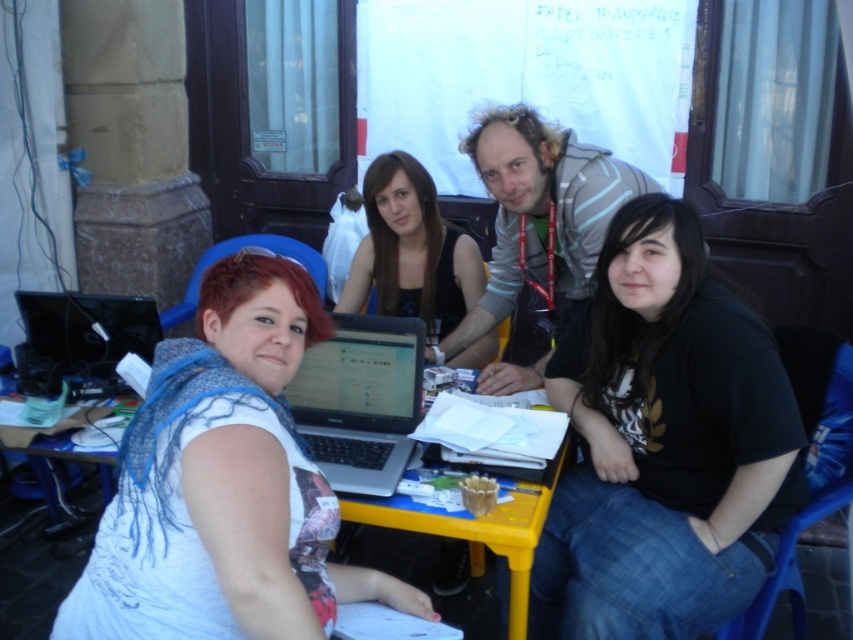
Based on the photo, is gray striped hoodie at center above silver metallic laptop at left?

Yes, gray striped hoodie at center is above silver metallic laptop at left.

From the picture: Is gray striped hoodie at center thinner than silver metallic laptop at left?

No, gray striped hoodie at center is not thinner than silver metallic laptop at left.

Is point (514, 276) positioned before point (36, 376)?

No.

Locate an element on the screen. The height and width of the screenshot is (640, 853). gray striped hoodie at center is located at coordinates pos(537,236).

Which is in front, point (405, 355) or point (416, 202)?

Point (405, 355) is in front.

Can you confirm if silver metallic laptop at center is shorter than matte black laptop at center?

Correct, silver metallic laptop at center is not as tall as matte black laptop at center.

This screenshot has height=640, width=853. Identify the location of silver metallic laptop at center. (360, 401).

Where is `silver metallic laptop at center`? This screenshot has height=640, width=853. silver metallic laptop at center is located at coordinates (360, 401).

Is gray striped hoodie at center thinner than silver metallic laptop at center?

In fact, gray striped hoodie at center might be wider than silver metallic laptop at center.

Does gray striped hoodie at center have a greater height compared to silver metallic laptop at center?

Yes.

Which is behind, point (498, 148) or point (337, 413)?

The point (498, 148) is behind.

Where is `gray striped hoodie at center`? The image size is (853, 640). gray striped hoodie at center is located at coordinates (537, 236).